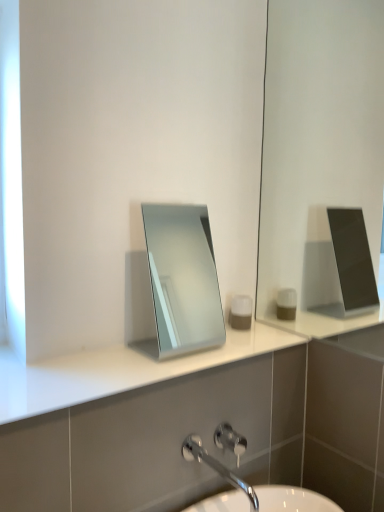
Question: Can you see white glossy counter top at center touching brushed metal shower at lower center?

Choices:
 (A) yes
 (B) no

Answer: (B)

Question: From the image's perspective, does white glossy counter top at center appear lower than brushed metal shower at lower center?

Choices:
 (A) no
 (B) yes

Answer: (A)

Question: Can you confirm if white glossy counter top at center is bigger than brushed metal shower at lower center?

Choices:
 (A) no
 (B) yes

Answer: (B)

Question: Does white glossy counter top at center appear on the left side of brushed metal shower at lower center?

Choices:
 (A) yes
 (B) no

Answer: (A)

Question: Considering the relative sizes of white glossy counter top at center and brushed metal shower at lower center in the image provided, is white glossy counter top at center shorter than brushed metal shower at lower center?

Choices:
 (A) yes
 (B) no

Answer: (A)

Question: From the image's perspective, is white glossy counter top at center above brushed metal shower at lower center?

Choices:
 (A) yes
 (B) no

Answer: (A)

Question: Considering the relative positions of silver metallic mirror at center and chrome metallic faucet at lower center in the image provided, is silver metallic mirror at center in front of chrome metallic faucet at lower center?

Choices:
 (A) no
 (B) yes

Answer: (A)

Question: Considering the relative sizes of silver metallic mirror at center and chrome metallic faucet at lower center in the image provided, is silver metallic mirror at center bigger than chrome metallic faucet at lower center?

Choices:
 (A) yes
 (B) no

Answer: (A)

Question: From the image's perspective, is silver metallic mirror at center located beneath chrome metallic faucet at lower center?

Choices:
 (A) yes
 (B) no

Answer: (B)

Question: Does silver metallic mirror at center have a greater height compared to chrome metallic faucet at lower center?

Choices:
 (A) no
 (B) yes

Answer: (B)

Question: Is silver metallic mirror at center not within chrome metallic faucet at lower center?

Choices:
 (A) no
 (B) yes

Answer: (B)

Question: Is silver metallic mirror at center to the left of chrome metallic faucet at lower center from the viewer's perspective?

Choices:
 (A) no
 (B) yes

Answer: (B)

Question: Is chrome metallic faucet at lower center located within brushed metal shower at lower center?

Choices:
 (A) yes
 (B) no

Answer: (B)